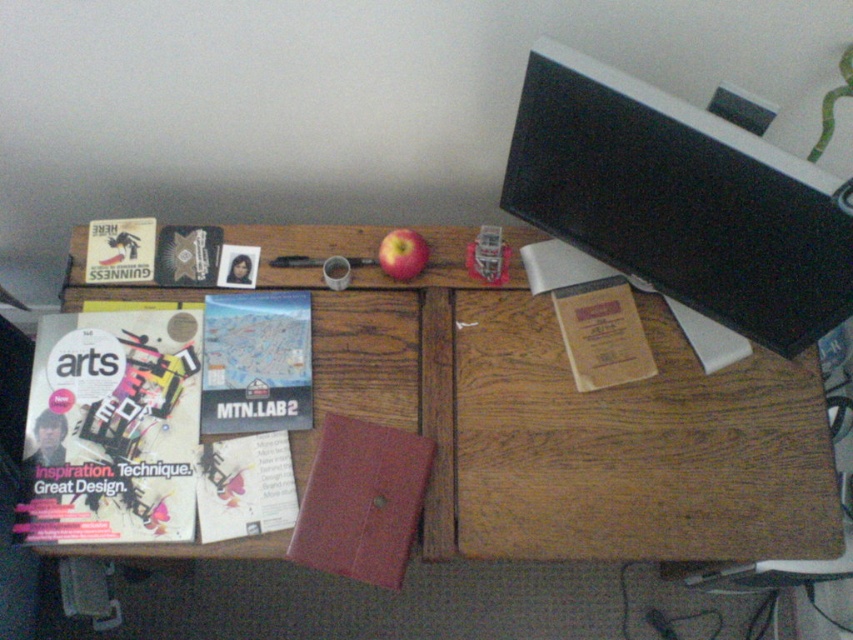
You are organizing the items on the wooden desk. You need to place a new item between the matte paper map at center and the matte black book at upper left. Where should you position it?

The matte paper map at center is below the matte black book at upper left, so you should position the new item between them either above the matte paper map at center or below the matte black book at upper left to place it in between.

Based on the photo, you are organizing items on the wooden desk and need to place the matte black book at upper left and the red matte apple at center. If you want to ensure both items fit side by side horizontally, which item should you consider the width of to determine the required space?

You should consider the width of the matte black book at upper left because it might be wider than the red matte apple at center, so ensuring there is enough space for the book will accommodate both items.

You are standing 1.2 meters away from the desk. Can you reach the point at coordinates (279, 360) on the desk without moving closer?

The distance of point (279, 360) from the viewer is 1.06 meters, so yes, you can reach it without moving closer since it is within your 1.2 meter range.